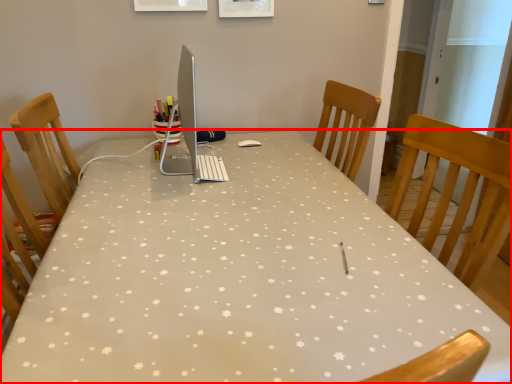
Question: From the image's perspective, where is table (annotated by the red box) located relative to desktop computer?

Choices:
 (A) above
 (B) below

Answer: (B)